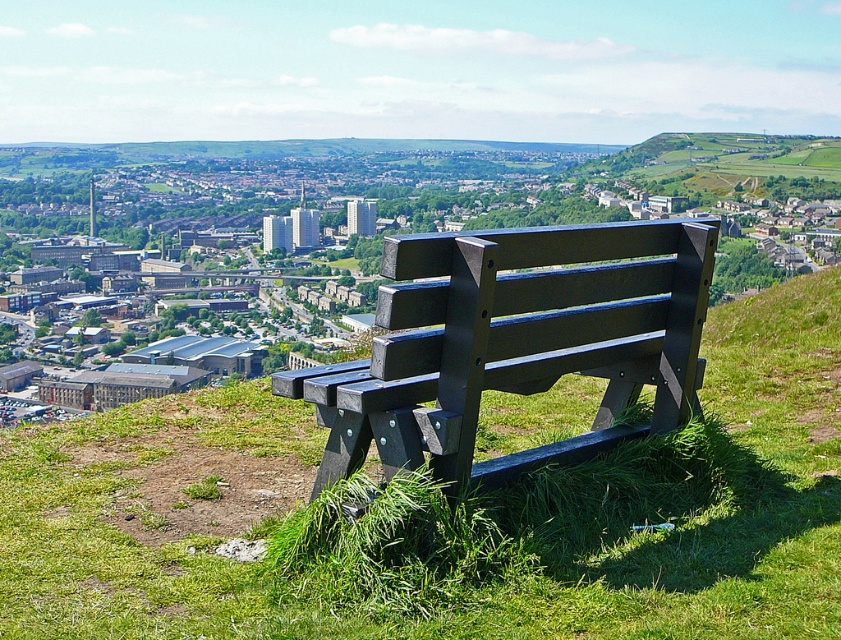
Question: Can you confirm if green grassy bench at center is positioned below matte black bench at center?

Choices:
 (A) yes
 (B) no

Answer: (B)

Question: Where is green grassy bench at center located in relation to matte black bench at center in the image?

Choices:
 (A) below
 (B) above

Answer: (B)

Question: Can you confirm if green grassy bench at center is positioned above matte black bench at center?

Choices:
 (A) no
 (B) yes

Answer: (B)